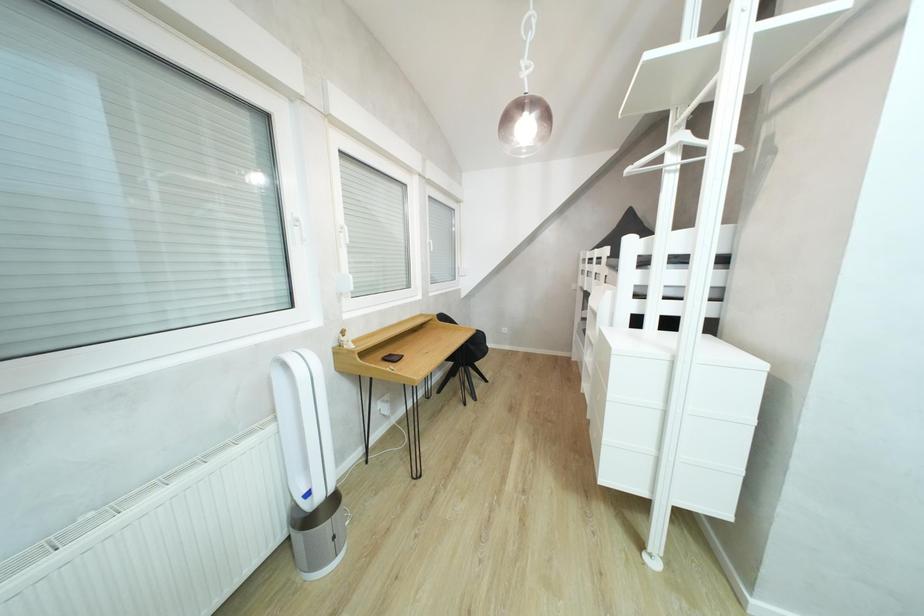
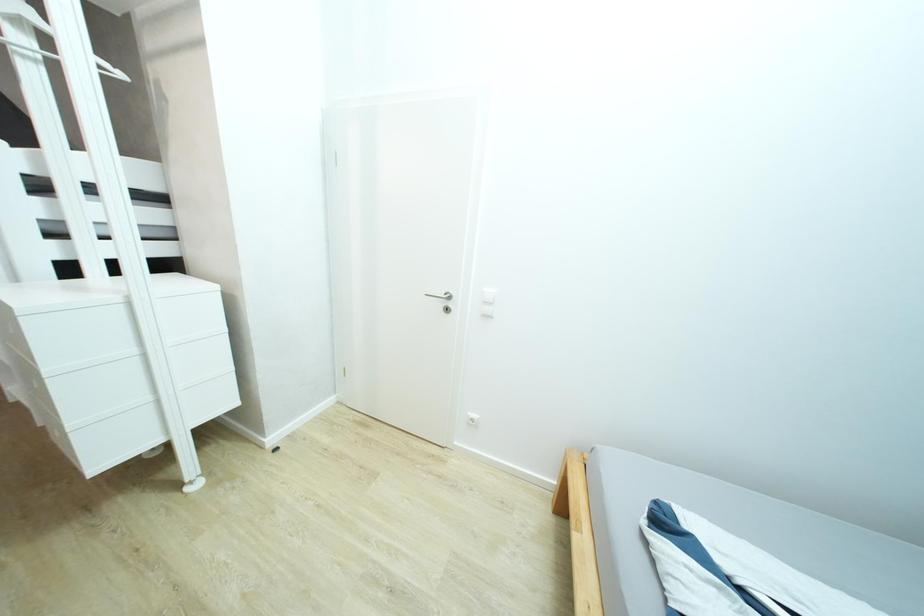
The images are taken continuously from a first-person perspective. In which direction is your viewpoint rotating?

The camera's rotation is toward right-down.